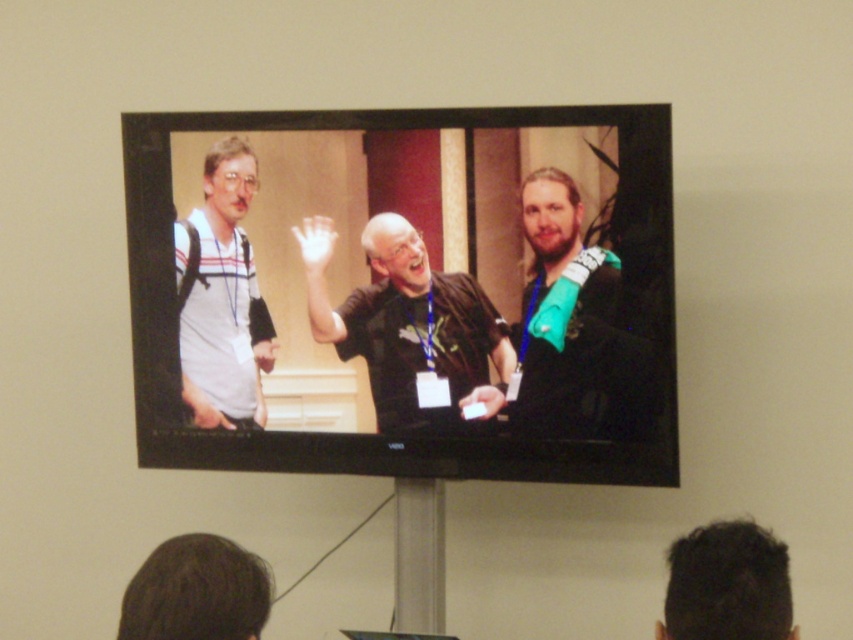
What is the location of the point (404, 292) on the image?

The point (404, 292) corresponds to the matte black tv at center.

Which object is at the point with coordinates (569, 323)?

The teal fabric arm at right is at the point with coordinates (569, 323).

From the picture: Where is the matte black tv at center located in the image?

The matte black tv at center is located at point 0.458 on the x axis and 0.475 on the y axis.